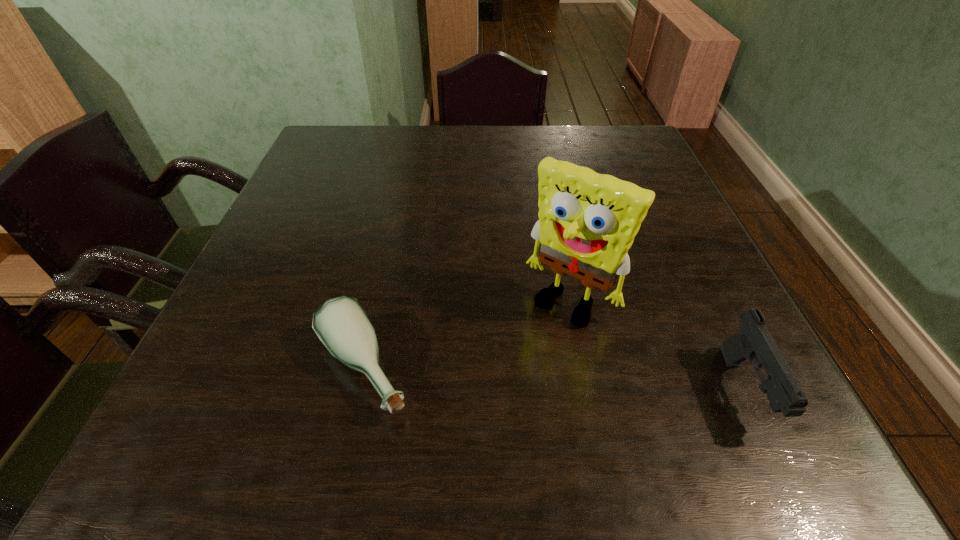
What are the coordinates of `bottle present at the near edge` in the screenshot? It's located at (342, 325).

Where is `pistol that is at the near edge`? The image size is (960, 540). pistol that is at the near edge is located at coordinates (754, 343).

Where is `object situated at the right edge`? This screenshot has height=540, width=960. object situated at the right edge is located at coordinates (754, 343).

The height and width of the screenshot is (540, 960). I want to click on object at the near right corner, so pyautogui.click(x=754, y=343).

In the image, there is a desktop. Where is `free space at the far edge`? The width and height of the screenshot is (960, 540). free space at the far edge is located at coordinates (472, 146).

This screenshot has height=540, width=960. What are the coordinates of `vacant space at the near edge` in the screenshot? It's located at (545, 363).

I want to click on vacant space at the left edge of the desktop, so click(282, 219).

The image size is (960, 540). I want to click on free location at the right edge, so click(654, 224).

In order to click on vacant space at the near left corner of the desktop in this screenshot , I will do coord(211,366).

This screenshot has width=960, height=540. I want to click on free space at the far right corner of the desktop, so click(x=645, y=147).